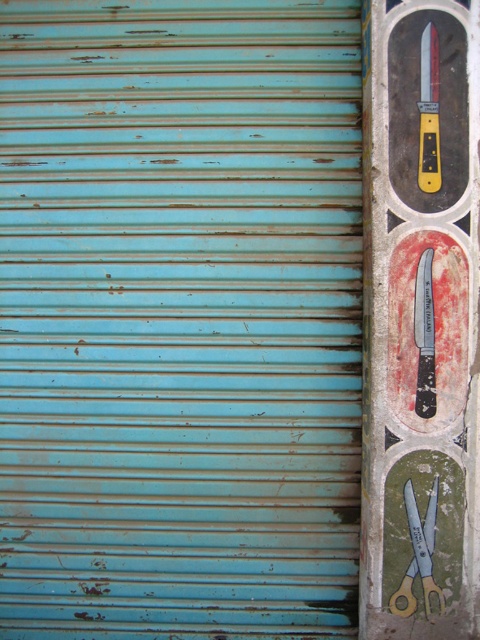
Question: Does painted wood knife at right have a smaller size compared to blue metallic scissors at right?

Choices:
 (A) no
 (B) yes

Answer: (A)

Question: Which object appears farthest from the camera in this image?

Choices:
 (A) painted wood knife at right
 (B) blue metallic scissors at right
 (C) black textured knife at right

Answer: (B)

Question: Based on their relative distances, which object is farther from the painted wood knife at right?

Choices:
 (A) blue metallic scissors at right
 (B) black textured knife at right

Answer: (A)

Question: Which of the following is the closest to the observer?

Choices:
 (A) painted wood knife at right
 (B) black textured knife at right

Answer: (A)

Question: Can you confirm if painted wood knife at right is positioned below black textured knife at right?

Choices:
 (A) no
 (B) yes

Answer: (A)

Question: Is painted wood knife at right behind black textured knife at right?

Choices:
 (A) no
 (B) yes

Answer: (A)